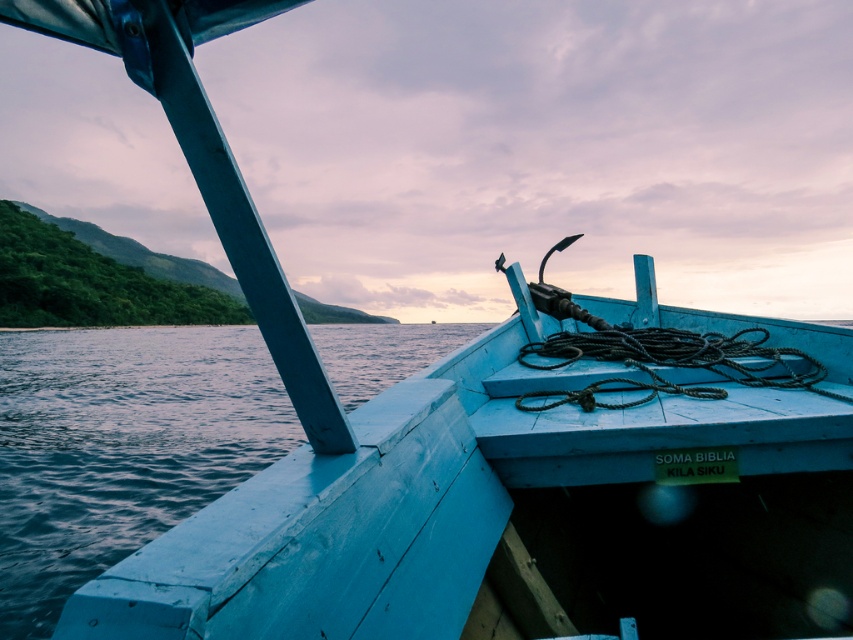
Question: Can you confirm if blue wooden water at lower left is positioned to the right of black rope at center?

Choices:
 (A) no
 (B) yes

Answer: (A)

Question: Which object appears closest to the camera in this image?

Choices:
 (A) blue wooden water at lower left
 (B) black rope at center

Answer: (A)

Question: From the image, what is the correct spatial relationship of blue wooden water at lower left in relation to black rope at center?

Choices:
 (A) above
 (B) below

Answer: (A)

Question: Which object appears farthest from the camera in this image?

Choices:
 (A) black rope at center
 (B) blue wooden water at lower left

Answer: (A)

Question: Can you confirm if blue wooden water at lower left is positioned above black rope at center?

Choices:
 (A) no
 (B) yes

Answer: (B)

Question: Which of the following is the farthest from the observer?

Choices:
 (A) black rope at center
 (B) blue wooden water at lower left

Answer: (A)